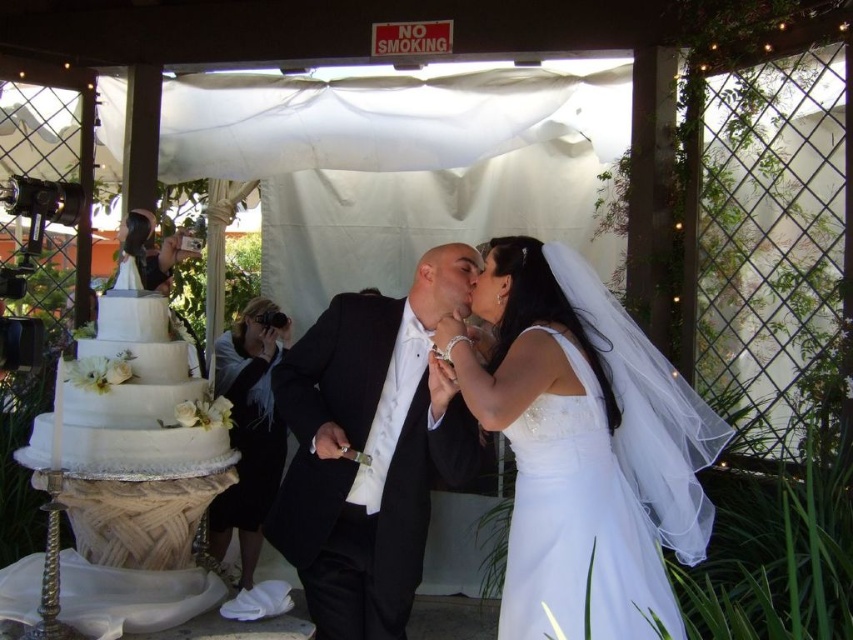
Question: Is white satin dress at center smaller than white fondant cake at left?

Choices:
 (A) no
 (B) yes

Answer: (A)

Question: Does white satin dress at center have a larger size compared to white fondant cake at left?

Choices:
 (A) yes
 (B) no

Answer: (A)

Question: Which point is closer to the camera taking this photo?

Choices:
 (A) (427, 273)
 (B) (86, 394)

Answer: (B)

Question: Which of the following is the closest to the observer?

Choices:
 (A) white satin dress at center
 (B) black satin tuxedo at center
 (C) white fondant cake at left

Answer: (A)

Question: Among these objects, which one is nearest to the camera?

Choices:
 (A) black satin tuxedo at center
 (B) white fondant cake at left

Answer: (B)

Question: Can you confirm if white satin dress at center is smaller than white fondant cake at left?

Choices:
 (A) yes
 (B) no

Answer: (B)